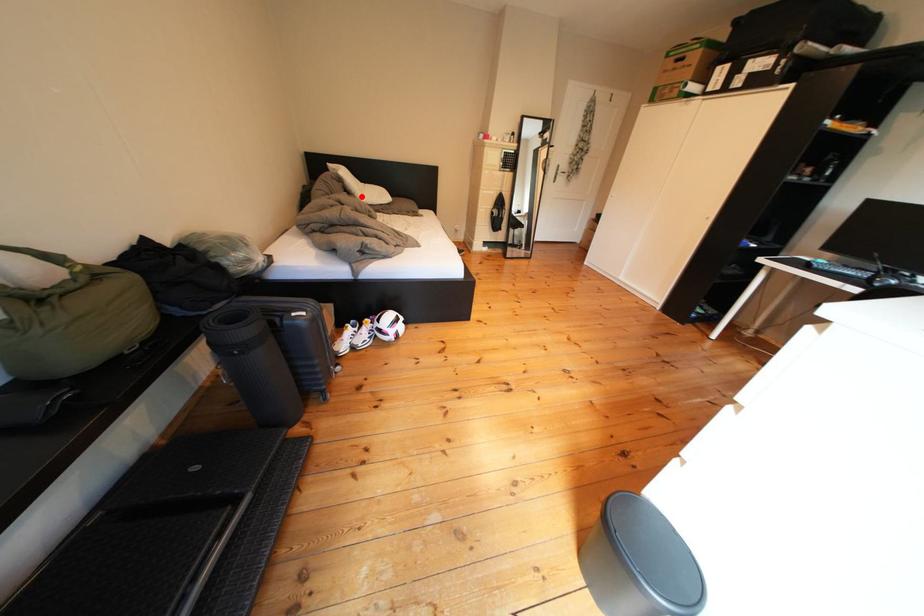
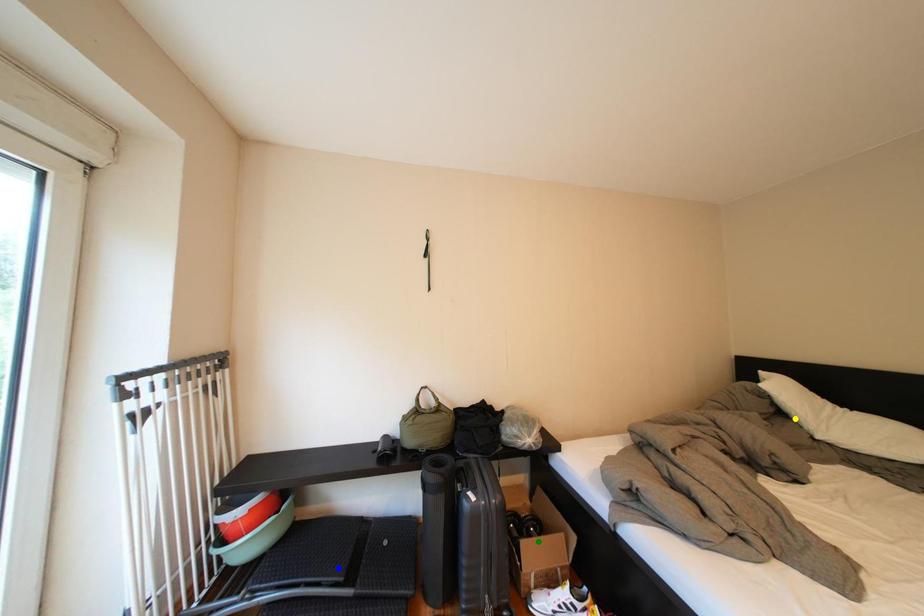
Question: I am providing you with two images of the same scene from different viewpoints. A red point is marked on the first image. You are given multiple points on the second image. Which point in image 2 represents the same 3d spot as the red point in image 1?

Choices:
 (A) green point
 (B) blue point
 (C) yellow point

Answer: (C)